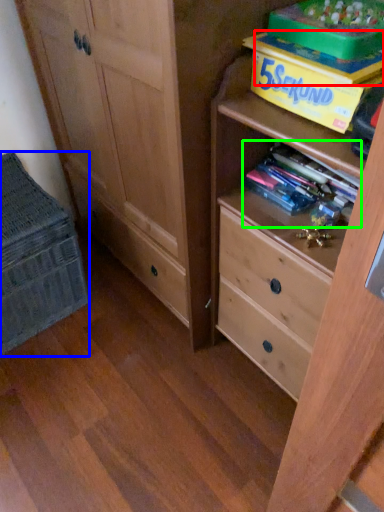
Question: Which is nearer to the book (highlighted by a red box)? cabinetry (highlighted by a blue box) or book (highlighted by a green box).

Choices:
 (A) cabinetry
 (B) book

Answer: (B)